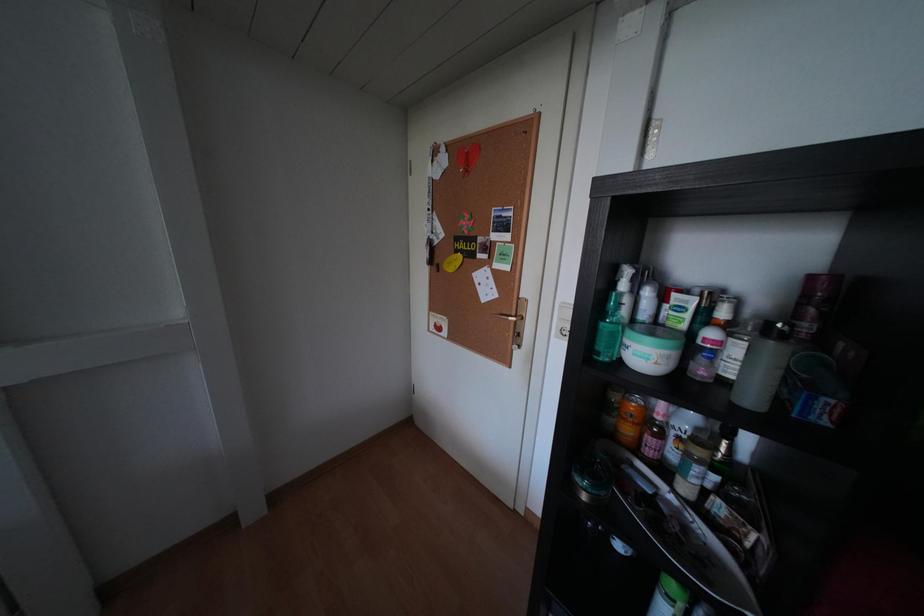
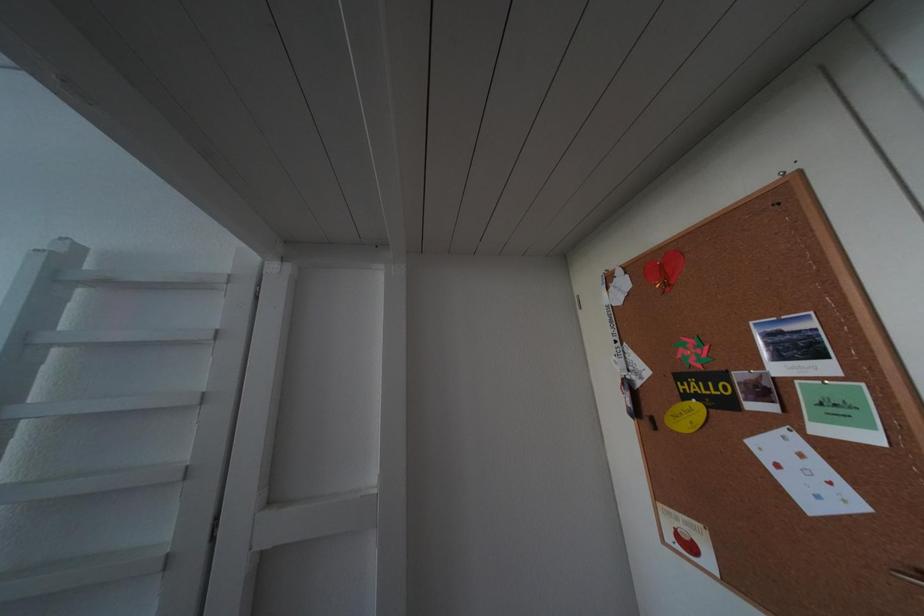
From the picture: The images are taken continuously from a first-person perspective. In which direction is your viewpoint rotating?

The rotation direction of the camera is left-up.